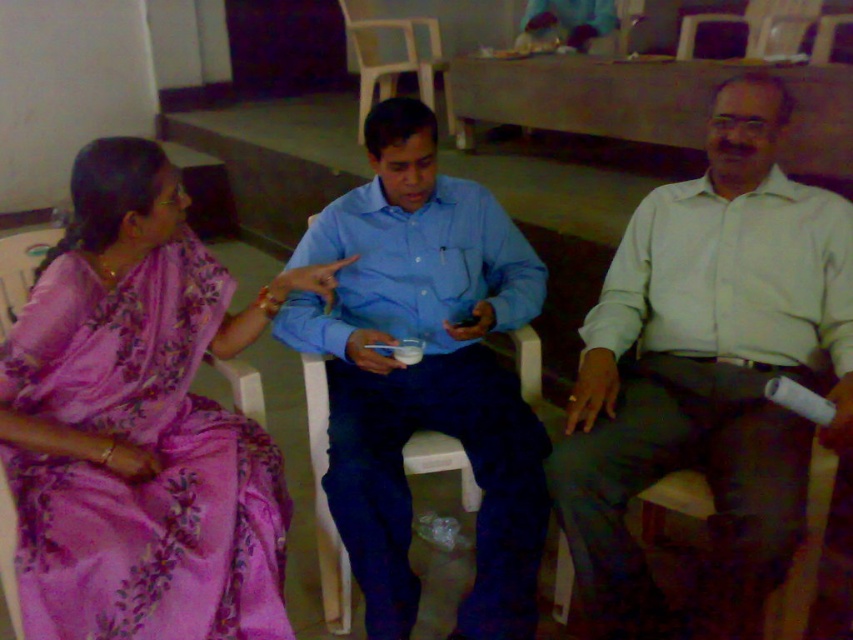
Question: Which object appears farthest from the camera in this image?

Choices:
 (A) blue cotton shirt at center
 (B) white plastic chair at center

Answer: (B)

Question: Does pink satin saree at left have a greater width compared to blue cotton shirt at center?

Choices:
 (A) yes
 (B) no

Answer: (B)

Question: Which object is farther from the camera taking this photo?

Choices:
 (A) light beige shirt at right
 (B) white plastic chair at center
 (C) blue cotton shirt at center

Answer: (B)

Question: Which object appears closest to the camera in this image?

Choices:
 (A) white plastic chair at center
 (B) light beige shirt at right

Answer: (B)

Question: Is pink satin saree at left to the left of white plastic chair at center from the viewer's perspective?

Choices:
 (A) yes
 (B) no

Answer: (A)

Question: Is light beige shirt at right smaller than blue cotton shirt at center?

Choices:
 (A) no
 (B) yes

Answer: (A)